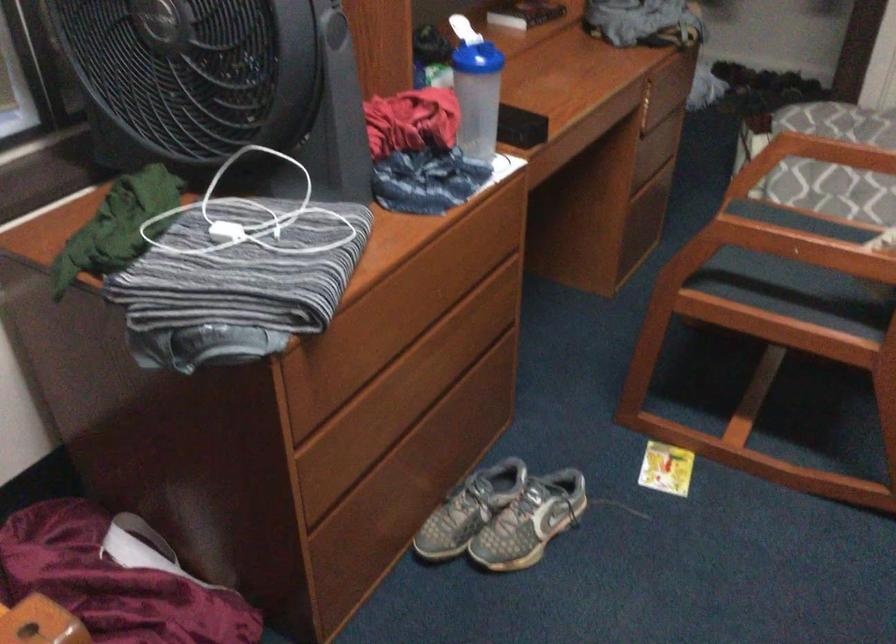
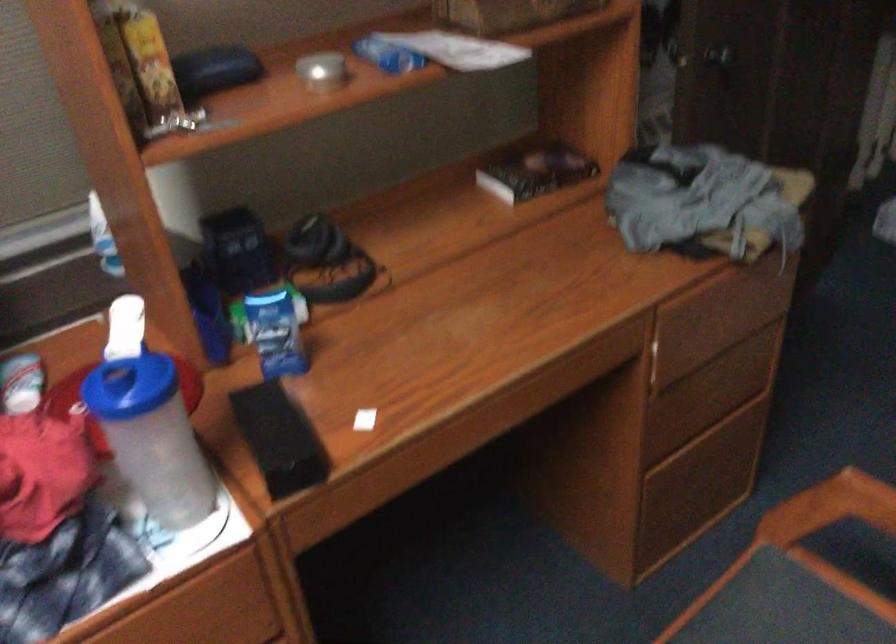
The point at (771, 154) is marked in the first image. Where is the corresponding point in the second image?

(830, 507)